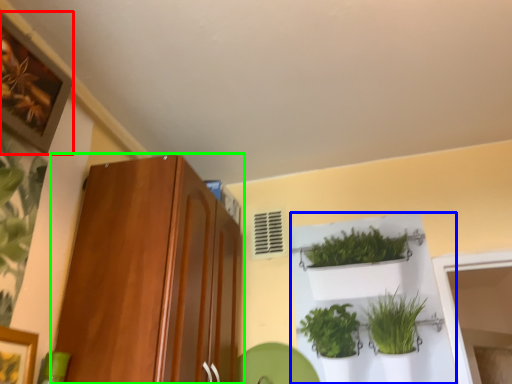
Question: Which is farther away from picture frame (highlighted by a red box)? shelf (highlighted by a blue box) or cabinetry (highlighted by a green box)?

Choices:
 (A) shelf
 (B) cabinetry

Answer: (A)